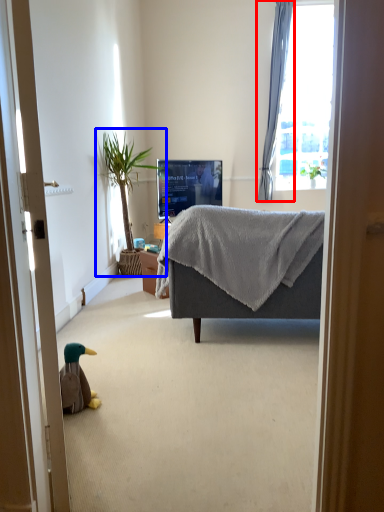
Question: Among these objects, which one is nearest to the camera, curtain (highlighted by a red box) or houseplant (highlighted by a blue box)?

Choices:
 (A) curtain
 (B) houseplant

Answer: (B)